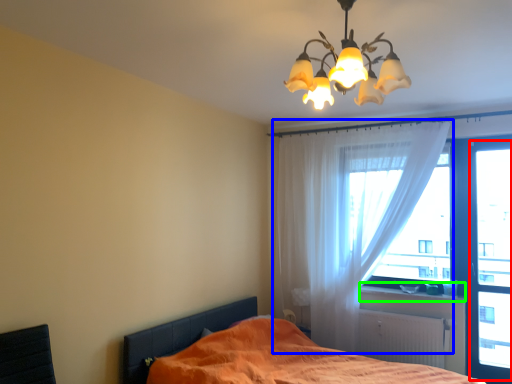
Question: Based on their relative distances, which object is farther from window screen (highlighted by a red box)? Choose from curtain (highlighted by a blue box) and window sill (highlighted by a green box).

Choices:
 (A) curtain
 (B) window sill

Answer: (A)